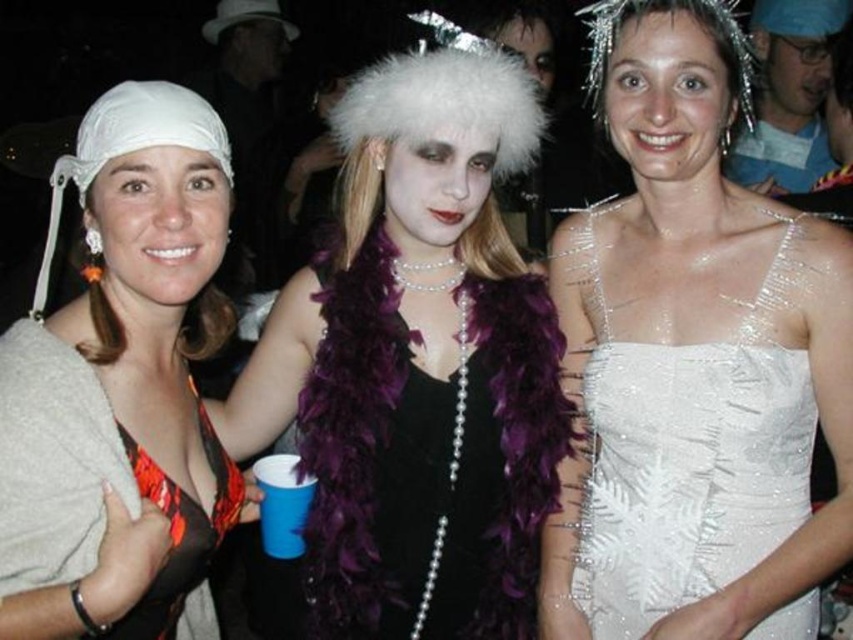
You are at a costume party and want to know if the white sequined dress at center can fit inside the purple feather boa at center. Based on their sizes, what do you think?

The white sequined dress at center is smaller than the purple feather boa at center, so it can fit inside.

You are a photographer at the event and need to capture both the purple feather boa at center and the orange printed fabric bikini top at left in a single shot. Which object should you focus on first to ensure both are in frame?

The purple feather boa at center is taller than the orange printed fabric bikini top at left. Focus on the taller object first to frame both properly.

You are organizing a costume party and need to arrange the white sequined dress at center and the orange printed fabric bikini top at left on a display rack. Which item requires more horizontal space due to its width?

The white sequined dress at center requires more horizontal space because its width is larger than the orange printed fabric bikini top at left.